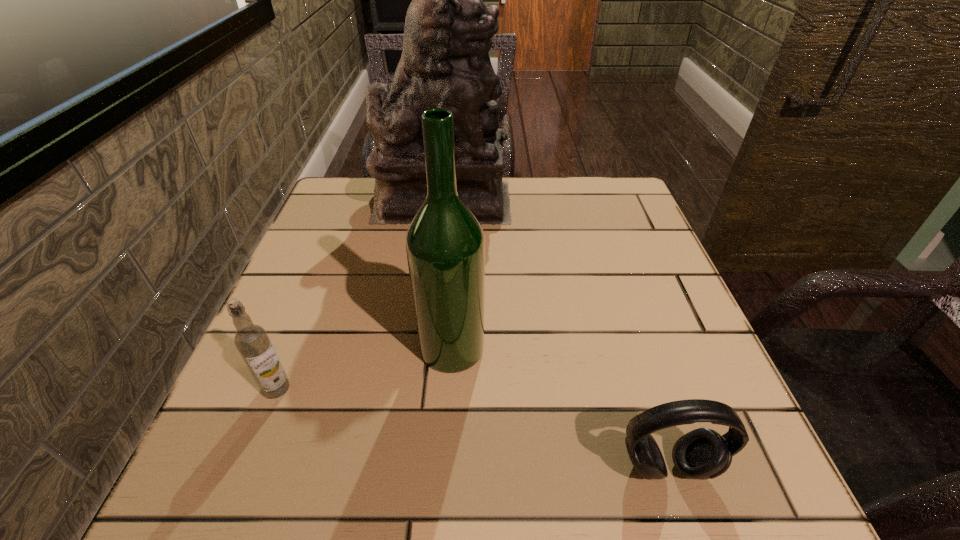
Where is `object at the near edge`? This screenshot has height=540, width=960. object at the near edge is located at coordinates (703, 453).

Identify the location of sculpture that is positioned at the left edge. The image size is (960, 540). (445, 63).

Where is `vodka present at the left edge`? This screenshot has height=540, width=960. vodka present at the left edge is located at coordinates (252, 341).

Identify the location of object that is at the right edge. The width and height of the screenshot is (960, 540). [x=703, y=453].

Identify the location of object at the far left corner. (445, 63).

The image size is (960, 540). Identify the location of object at the near right corner. (703, 453).

Where is `vacant region at the far edge`? The width and height of the screenshot is (960, 540). vacant region at the far edge is located at coordinates pos(572,217).

In the image, there is a desktop. Where is `blank space at the near edge`? The height and width of the screenshot is (540, 960). blank space at the near edge is located at coordinates (372, 494).

Locate an element on the screen. vacant space at the left edge of the desktop is located at coordinates (325, 327).

The image size is (960, 540). What are the coordinates of `blank space at the right edge of the desktop` in the screenshot? It's located at (722, 374).